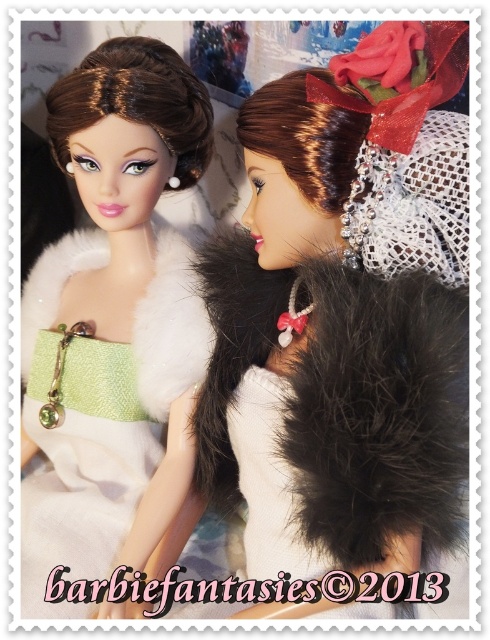
Looking at this image, you are a fashion designer observing two dolls in the image. The first doll has a matte white fur at upper left, and the second has a matte white fur coat at left. Which of these two items is wider?

The matte white fur at upper left is wider than the matte white fur coat at left.

You are a photographer adjusting your camera to focus on two points in the image. The first point is labeled as point (441, 28) and the second is point (118, 253). Since you want to ensure both points are in focus, which point should you adjust the focus to first based on their positions?

Point (441, 28) is in front of point (118, 253), so you should focus on point (441, 28) first to ensure both are in focus.